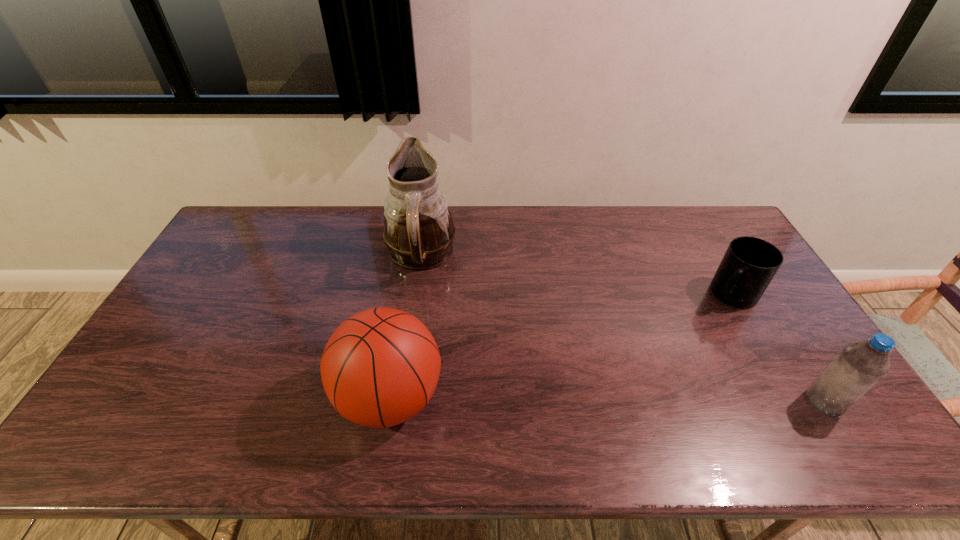
I want to click on basketball, so click(x=381, y=366).

Locate an element on the screen. This screenshot has width=960, height=540. water bottle is located at coordinates (859, 366).

Locate an element on the screen. The image size is (960, 540). the tallest object is located at coordinates (418, 231).

The image size is (960, 540). What are the coordinates of `mug` in the screenshot? It's located at pos(749,264).

You are a GUI agent. You are given a task and a screenshot of the screen. Output one action in this format:
    pyautogui.click(x=<x>, y=<y>)
    Task: Click on the vacant area located on the back of the basketball
    
    Given the screenshot: What is the action you would take?
    pyautogui.click(x=408, y=287)

This screenshot has height=540, width=960. I want to click on free space located 0.350m on the back of the water bottle, so click(x=755, y=291).

Locate an element on the screen. The width and height of the screenshot is (960, 540). blank area located 0.360m from the spout of the tallest object is located at coordinates (521, 348).

Where is `free point located from the spout of the tallest object`? free point located from the spout of the tallest object is located at coordinates (474, 308).

I want to click on free space located 0.070m from the spout of the tallest object, so click(455, 292).

At what (x,y) coordinates should I click in order to perform the action: click on free spot located 0.390m on the side of the shortest object with the handle. Please return your answer as a coordinate pair (x, y). The width and height of the screenshot is (960, 540). Looking at the image, I should click on (651, 383).